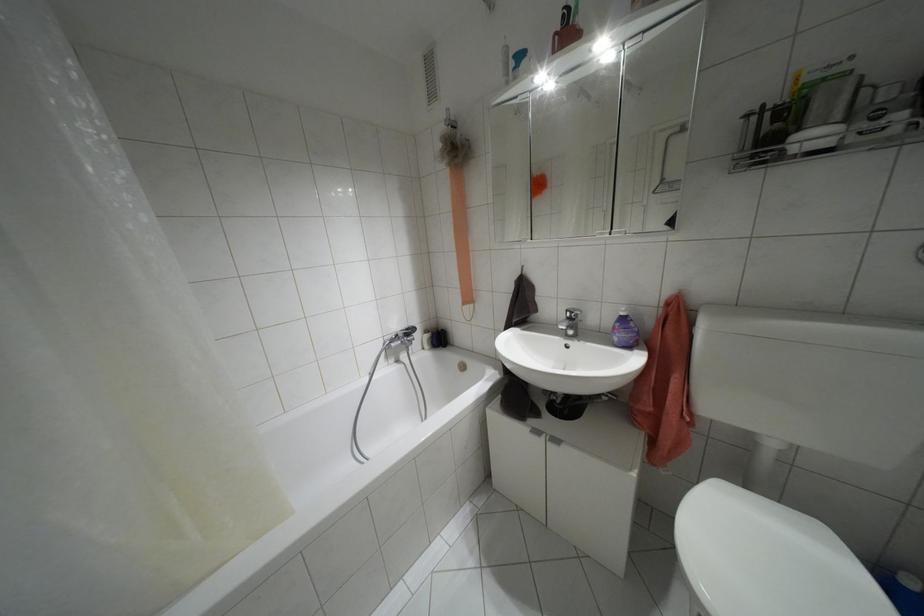
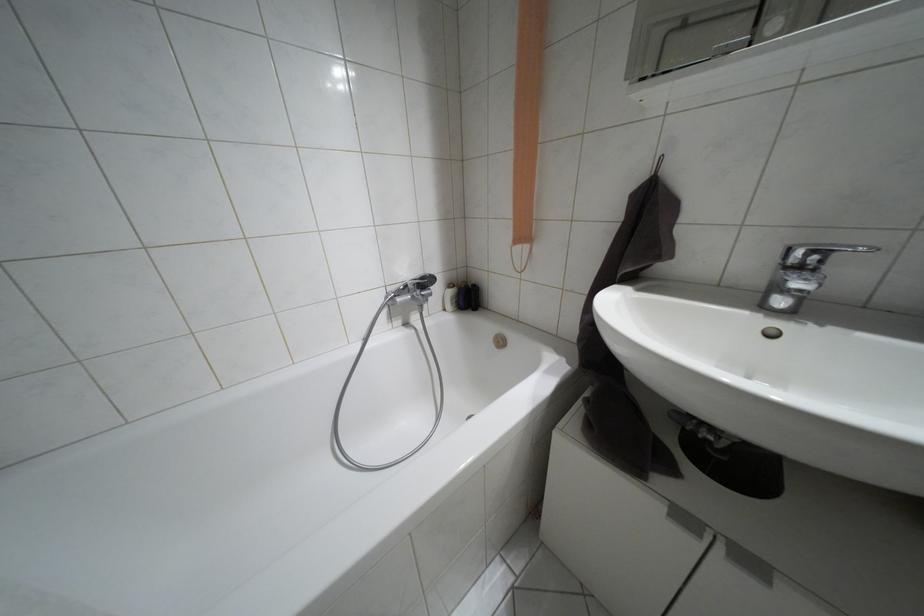
Question: The first image is from the beginning of the video and the second image is from the end. How did the camera likely rotate when shooting the video?

Choices:
 (A) Left
 (B) Right
 (C) Up
 (D) Down

Answer: (D)